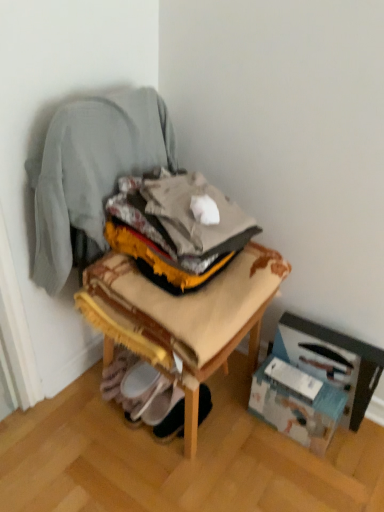
Question: Is wooden stool at center inside the boundaries of white cardboard box at lower right, marked as the 2th cardboard box in a left-to-right arrangement, or outside?

Choices:
 (A) inside
 (B) outside

Answer: (B)

Question: In terms of height, does wooden stool at center look taller or shorter compared to white cardboard box at lower right, marked as the 2th cardboard box in a left-to-right arrangement?

Choices:
 (A) short
 (B) tall

Answer: (A)

Question: Based on their relative distances, which object is nearer to the white cardboard box at lower right, marked as the 2th cardboard box in a left-to-right arrangement?

Choices:
 (A) white fabric shoe at lower center
 (B) wooden stool at center
 (C) teal cardboard box at lower right, which is the 2th cardboard box in right-to-left order
 (D) wooden chair at center

Answer: (C)

Question: Estimate the real-world distances between objects in this image. Which object is closer to the wooden stool at center?

Choices:
 (A) white cardboard box at lower right, which appears as the first cardboard box when viewed from the right
 (B) teal cardboard box at lower right, which is the 2th cardboard box in right-to-left order
 (C) wooden chair at center
 (D) white fabric shoe at lower center

Answer: (C)